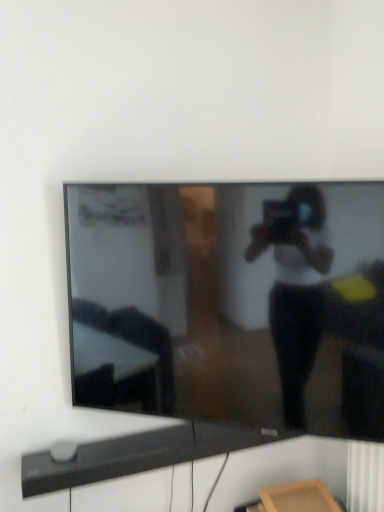
The width and height of the screenshot is (384, 512). Describe the element at coordinates (230, 302) in the screenshot. I see `black glossy tv at center` at that location.

Measure the distance between black glossy tv at center and camera.

black glossy tv at center is 1.08 meters away from camera.

Locate an element on the screen. The image size is (384, 512). black glossy tv at center is located at coordinates (230, 302).

Where is `black matte soundbar at lower center`? black matte soundbar at lower center is located at coordinates (136, 455).

This screenshot has width=384, height=512. What do you see at coordinates (136, 455) in the screenshot? I see `black matte soundbar at lower center` at bounding box center [136, 455].

Find the location of `black glossy tv at center`. black glossy tv at center is located at coordinates [230, 302].

Which is more to the right, black glossy tv at center or black matte soundbar at lower center?

black glossy tv at center.

Considering the positions of objects black glossy tv at center and black matte soundbar at lower center in the image provided, who is in front, black glossy tv at center or black matte soundbar at lower center?

black glossy tv at center is more forward.

Does point (208, 360) appear closer or farther from the camera than point (136, 459)?

Point (208, 360).

From the image's perspective, is black glossy tv at center located above or below black matte soundbar at lower center?

Clearly, from the image's perspective, black glossy tv at center is above black matte soundbar at lower center.

From a real-world perspective, is black glossy tv at center over black matte soundbar at lower center?

Yes, from a real-world perspective, black glossy tv at center is above black matte soundbar at lower center.

Can you confirm if black glossy tv at center is thinner than black matte soundbar at lower center?

Indeed, black glossy tv at center has a lesser width compared to black matte soundbar at lower center.

Considering the sizes of objects black glossy tv at center and black matte soundbar at lower center in the image provided, who is taller, black glossy tv at center or black matte soundbar at lower center?

Standing taller between the two is black glossy tv at center.

Is black glossy tv at center bigger than black matte soundbar at lower center?

Indeed, black glossy tv at center has a larger size compared to black matte soundbar at lower center.

Is black glossy tv at center inside or outside of black matte soundbar at lower center?

black glossy tv at center lies outside black matte soundbar at lower center.

Is black glossy tv at center positioned far away from black matte soundbar at lower center?

They are positioned close to each other.

Is black glossy tv at center facing away from black matte soundbar at lower center?

black glossy tv at center is not turned away from black matte soundbar at lower center.

Can you tell me how much black glossy tv at center and black matte soundbar at lower center differ in facing direction?

The angle between the facing direction of black glossy tv at center and the facing direction of black matte soundbar at lower center is 32.6 degrees.

Measure the distance from black glossy tv at center to black matte soundbar at lower center.

black glossy tv at center is 16.70 inches away from black matte soundbar at lower center.

Image resolution: width=384 pixels, height=512 pixels. I want to click on computer desk on the left of the black glossy tv at center, so click(136, 455).

Can you confirm if black matte soundbar at lower center is positioned to the left of black glossy tv at center?

Correct, you'll find black matte soundbar at lower center to the left of black glossy tv at center.

Which object is closer to the camera, black matte soundbar at lower center or black glossy tv at center?

black glossy tv at center is closer to the camera.

Is point (37, 464) in front of point (249, 347)?

No, it is not.

From the image's perspective, is black matte soundbar at lower center above or below black glossy tv at center?

Clearly, from the image's perspective, black matte soundbar at lower center is below black glossy tv at center.

From a real-world perspective, is black matte soundbar at lower center above or below black glossy tv at center?

In terms of real-world spatial position, black matte soundbar at lower center is below black glossy tv at center.

Is black matte soundbar at lower center thinner than black glossy tv at center?

No, black matte soundbar at lower center is not thinner than black glossy tv at center.

Considering the sizes of black matte soundbar at lower center and black glossy tv at center in the image, is black matte soundbar at lower center taller or shorter than black glossy tv at center?

Considering their sizes, black matte soundbar at lower center has less height than black glossy tv at center.

In terms of size, does black matte soundbar at lower center appear bigger or smaller than black glossy tv at center?

Considering their sizes, black matte soundbar at lower center takes up less space than black glossy tv at center.

Would you say black matte soundbar at lower center is inside or outside black glossy tv at center?

black matte soundbar at lower center is outside black glossy tv at center.

Are black matte soundbar at lower center and black glossy tv at center making contact?

They are not placed beside each other.

Is black matte soundbar at lower center oriented towards black glossy tv at center?

No, black matte soundbar at lower center is not oriented towards black glossy tv at center.

How different are the orientations of black matte soundbar at lower center and black glossy tv at center in degrees?

The angle between the facing direction of black matte soundbar at lower center and the facing direction of black glossy tv at center is 32.6 degrees.

You are a GUI agent. You are given a task and a screenshot of the screen. Output one action in this format:
    pyautogui.click(x=<x>, y=<y>)
    Task: Click on the television above the black matte soundbar at lower center (from a real-world perspective)
    This screenshot has height=512, width=384.
    Given the screenshot: What is the action you would take?
    pyautogui.click(x=230, y=302)

Find the location of `computer desk lying behind the black glossy tv at center`. computer desk lying behind the black glossy tv at center is located at coordinates (136, 455).

Identify the location of television in front of the black matte soundbar at lower center. (230, 302).